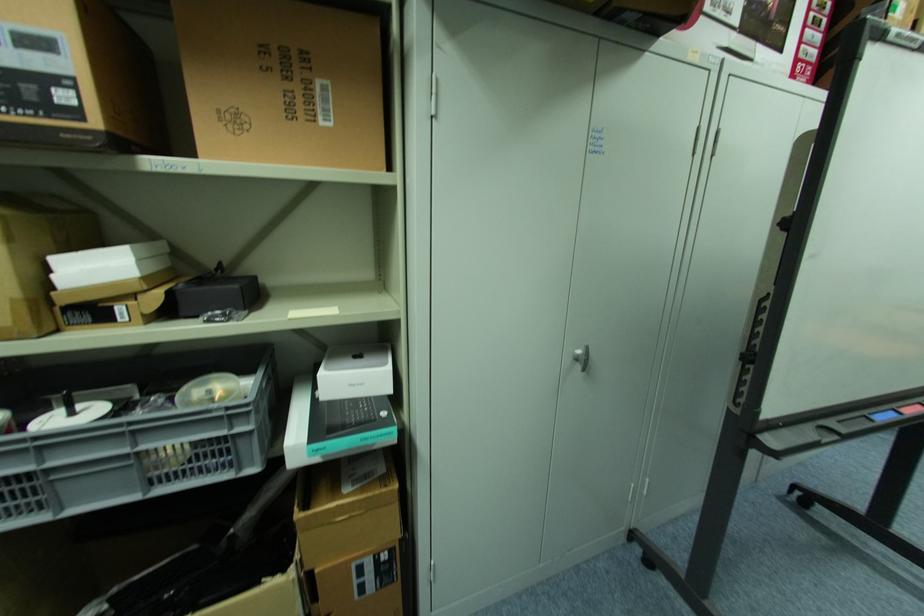
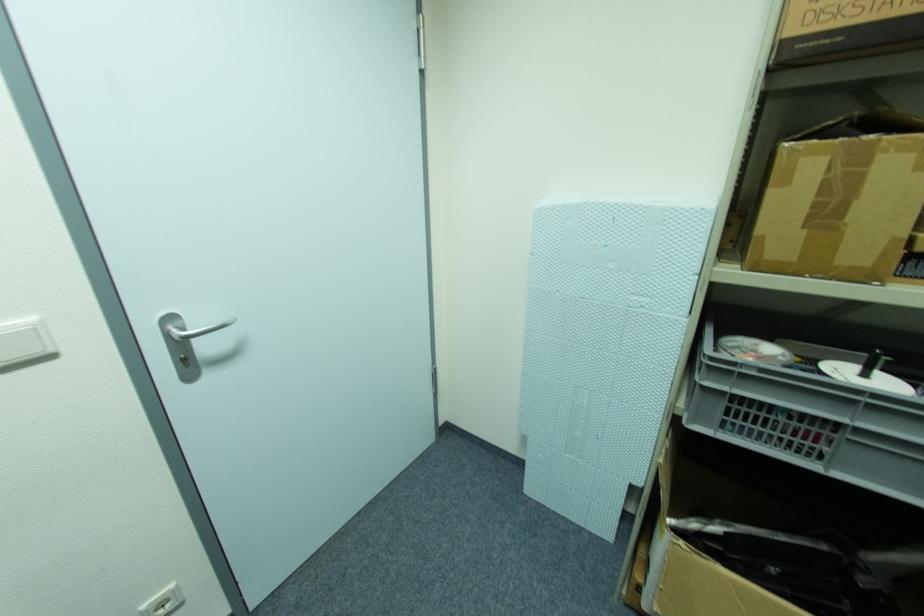
Find the pixel in the second image that matches (51,469) in the first image.

(859, 432)